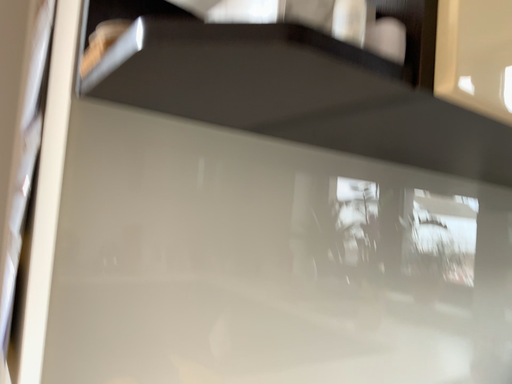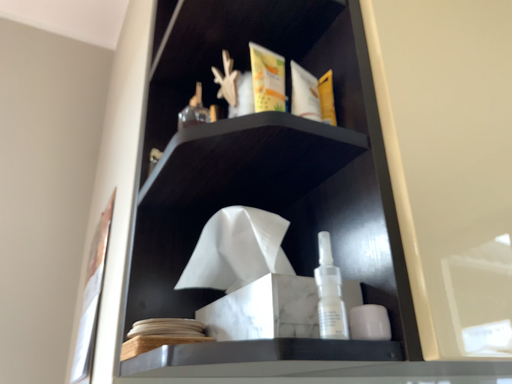
Question: How did the camera likely rotate when shooting the video?

Choices:
 (A) rotated downward
 (B) rotated upward

Answer: (B)